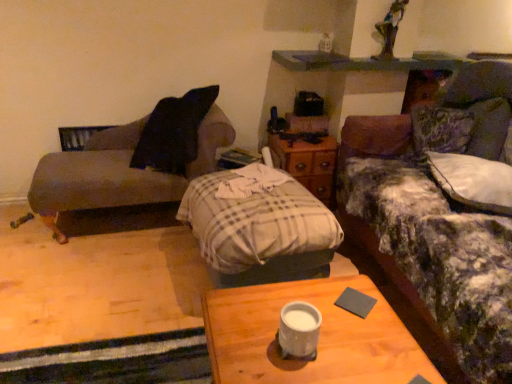
I want to click on free space behind gray matte pad at center, so click(x=350, y=284).